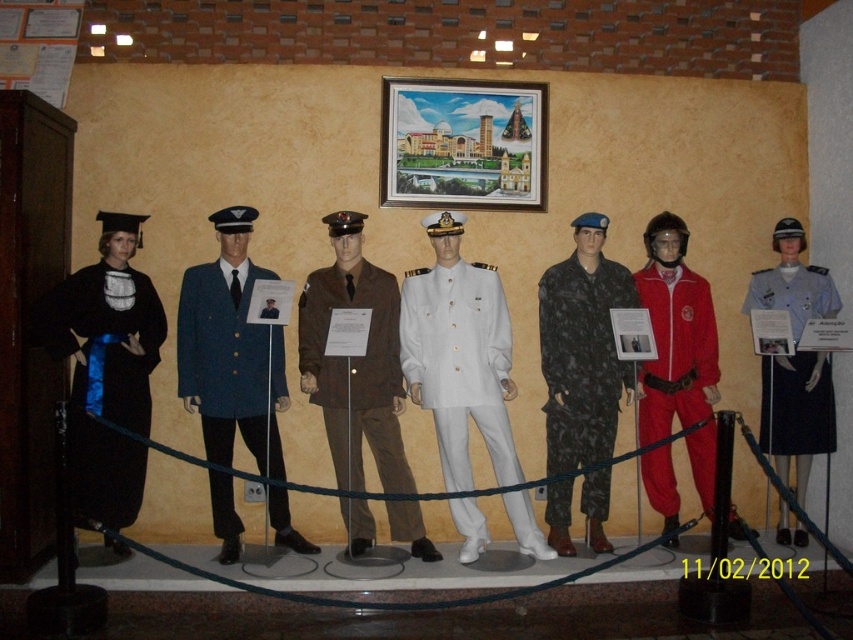
Is white matte uniform at center smaller than blue woolen coat at center?

No.

Who is shorter, white matte uniform at center or blue woolen coat at center?

Standing shorter between the two is blue woolen coat at center.

Is point (477, 540) positioned before point (281, 348)?

Yes, point (477, 540) is in front of point (281, 348).

The image size is (853, 640). I want to click on white matte uniform at center, so click(460, 364).

Can you confirm if brown woolen coat at center is positioned below blue woolen coat at center?

Yes.

Is point (358, 284) farther from viewer compared to point (264, 451)?

Yes, it is behind point (264, 451).

Locate an element on the screen. brown woolen coat at center is located at coordinates (355, 372).

From the picture: Does white matte uniform at center have a lesser height compared to camouflage fabric jumpsuit at center?

Incorrect, white matte uniform at center's height does not fall short of camouflage fabric jumpsuit at center's.

Does white matte uniform at center have a smaller size compared to camouflage fabric jumpsuit at center?

Yes, white matte uniform at center is smaller than camouflage fabric jumpsuit at center.

Who is more distant from viewer, (399,356) or (579,273)?

Point (579,273)

The image size is (853, 640). I want to click on white matte uniform at center, so click(460, 364).